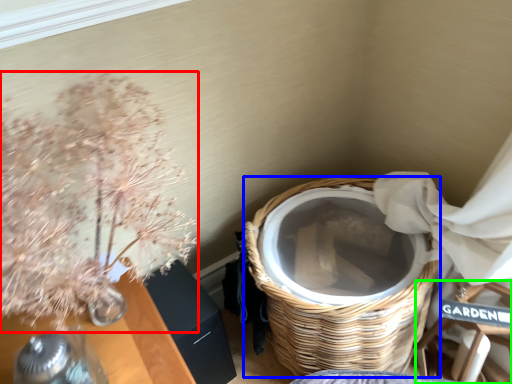
Question: Which object is positioned farthest from floral arrangement (highlighted by a red box)? Select from basket (highlighted by a blue box) and armchair (highlighted by a green box).

Choices:
 (A) basket
 (B) armchair

Answer: (B)